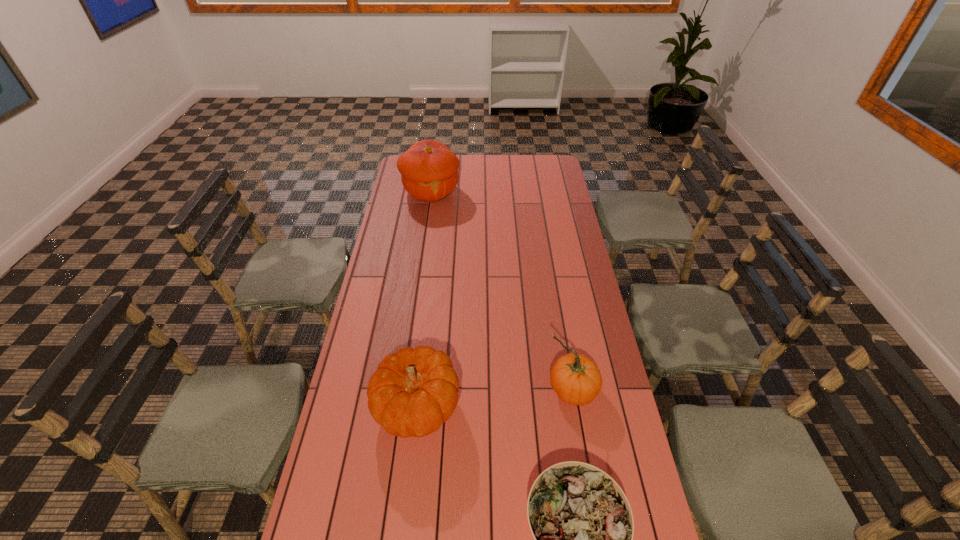
Identify the location of the farthest object. (429, 169).

Locate an element on the screen. the rightmost pumpkin is located at coordinates (576, 379).

Find the location of a particular element. Image resolution: width=960 pixels, height=540 pixels. the shortest pumpkin is located at coordinates (412, 392).

At what (x,y) coordinates should I click in order to perform the action: click on vacant space situated on the front of the farthest object. Please return your answer as a coordinate pair (x, y). The width and height of the screenshot is (960, 540). Looking at the image, I should click on (427, 219).

Identify the location of vacant space situated on the front of the rightmost pumpkin. (580, 441).

Find the location of `free region located 0.070m on the front of the shortest pumpkin`. free region located 0.070m on the front of the shortest pumpkin is located at coordinates (409, 476).

Locate an element on the screen. The height and width of the screenshot is (540, 960). object that is at the far edge is located at coordinates (429, 169).

This screenshot has width=960, height=540. Find the location of `object positioned at the right edge`. object positioned at the right edge is located at coordinates (576, 379).

Find the location of a particular element. object that is at the far left corner is located at coordinates (429, 169).

Identify the location of free location at the far edge. This screenshot has height=540, width=960. coord(469,178).